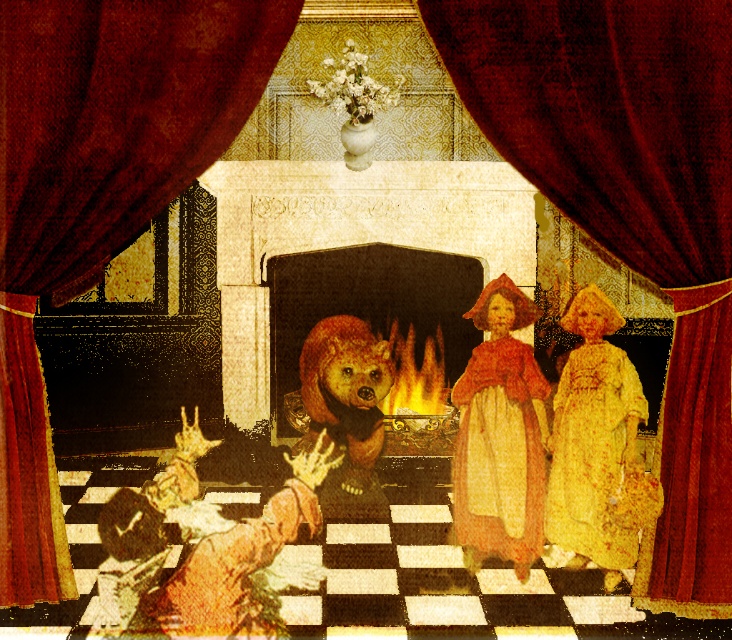
In the surreal stage scene with the ornate golden fireplace and a shadowy bear figure, you notice two dresses at the center. The dresses are labeled as the yellow floral fabric dress at center and the velvet yellow dress at center. Which dress is located to the right when viewed from the front of the stage?

The yellow floral fabric dress at center is positioned on the right side of the velvet yellow dress at center, so it is located to the right when viewed from the front of the stage.

In the scene shown: You are an actor standing on stage and need to move to the point marked at coordinates (597,460). Which object is located at that position?

The point at coordinates (597,460) is located on the yellow floral fabric dress at center.